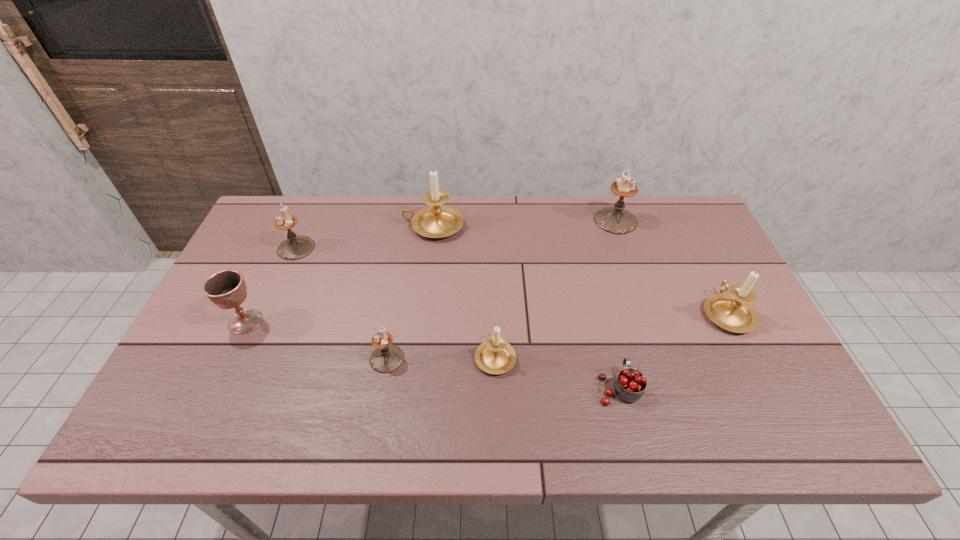
The height and width of the screenshot is (540, 960). Identify the location of vacant space at the far left corner. (301, 210).

Locate an element on the screen. The width and height of the screenshot is (960, 540). free point at the far right corner is located at coordinates click(x=677, y=213).

Find the location of a particular element. This screenshot has width=960, height=540. vacant area that lies between the second nearest purple candle holder and the leftmost beige candle holder is located at coordinates (365, 237).

Find the location of a particular element. The height and width of the screenshot is (540, 960). unoccupied area between the rightmost object and the farthest beige candle holder is located at coordinates (580, 269).

Find the location of a particular element. empty location between the brown chalice and the second biggest beige candle holder is located at coordinates (486, 317).

This screenshot has width=960, height=540. In order to click on blank region between the cherry and the smallest beige candle holder in this screenshot , I will do `click(557, 372)`.

The width and height of the screenshot is (960, 540). Find the location of `empty space between the rightmost object and the third object from right to left`. empty space between the rightmost object and the third object from right to left is located at coordinates (673, 350).

Locate an element on the screen. The height and width of the screenshot is (540, 960). vacant space in between the brown chalice and the second smallest purple candle holder is located at coordinates (271, 285).

Find the location of a particular element. vacant area between the fifth object from left to right and the leftmost purple candle holder is located at coordinates (396, 302).

Locate an element on the screen. This screenshot has width=960, height=540. vacant space in between the third object from right to left and the second object from right to left is located at coordinates (617, 304).